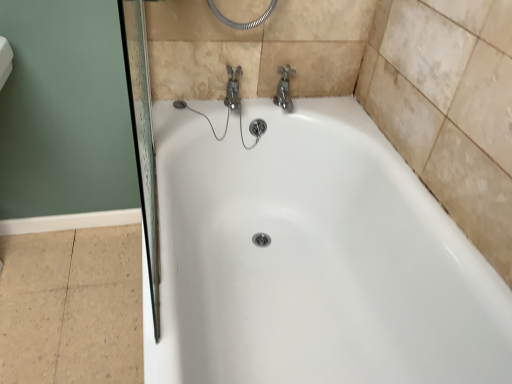
The image size is (512, 384). Identify the location of vacant space to the right of chrome metallic faucet at upper center. (338, 110).